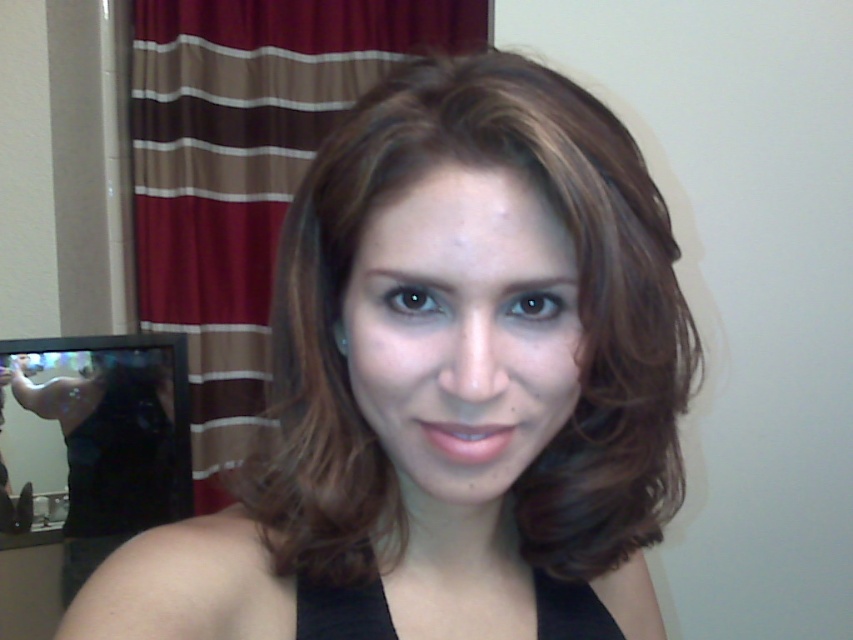
Looking at this image, you are a photographer setting up for a portrait session. You need to position a light source between the matte black hair at center and the black satin dress at lower left. The light source is 0.5 meters wide. Is there enough space to place it without overlapping either object?

The distance between the matte black hair at center and the black satin dress at lower left is 1.27 meters. Since the light source is 0.5 meters wide, there is sufficient space to place it between them without overlapping either object.

You are organizing a fashion show and need to arrange two black satin dresses in the scene. The dresses are labeled as the black satin dress at lower left and the black satin dress at center. Based on their positions and sizes, which dress should be placed first in the runway to ensure visibility from the front row seats?

The black satin dress at lower left should be placed first because it is taller than the black satin dress at center, ensuring that the taller dress is visible from the front row seats.